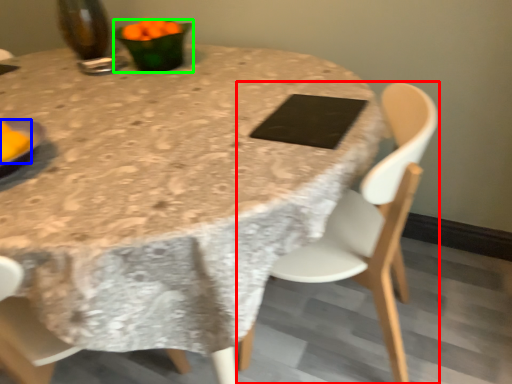
Question: Estimate the real-world distances between objects in this image. Which object is closer to chair (highlighted by a red box), food (highlighted by a blue box) or tableware (highlighted by a green box)?

Choices:
 (A) food
 (B) tableware

Answer: (B)